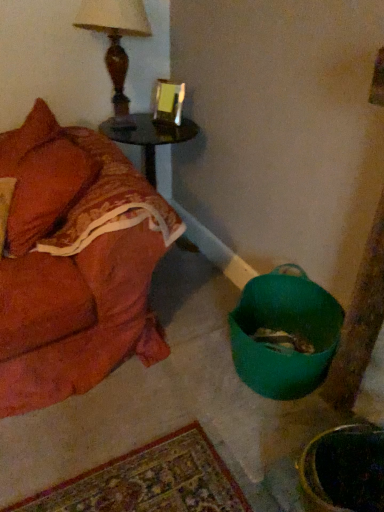
Question: Does shiny dark wood side table at upper left appear on the right side of wooden table lamp at upper left?

Choices:
 (A) no
 (B) yes

Answer: (B)

Question: Can wooden table lamp at upper left be found inside shiny dark wood side table at upper left?

Choices:
 (A) yes
 (B) no

Answer: (B)

Question: Is the position of shiny dark wood side table at upper left more distant than that of wooden table lamp at upper left?

Choices:
 (A) yes
 (B) no

Answer: (A)

Question: From a real-world perspective, is shiny dark wood side table at upper left positioned under wooden table lamp at upper left based on gravity?

Choices:
 (A) no
 (B) yes

Answer: (B)

Question: Does shiny dark wood side table at upper left come in front of wooden table lamp at upper left?

Choices:
 (A) no
 (B) yes

Answer: (A)

Question: Could you tell me if shiny dark wood side table at upper left is turned towards wooden table lamp at upper left?

Choices:
 (A) yes
 (B) no

Answer: (B)

Question: Are wooden table lamp at upper left and shiny dark wood side table at upper left beside each other?

Choices:
 (A) no
 (B) yes

Answer: (A)

Question: From the image's perspective, is wooden table lamp at upper left beneath shiny dark wood side table at upper left?

Choices:
 (A) no
 (B) yes

Answer: (A)

Question: Does wooden table lamp at upper left turn towards shiny dark wood side table at upper left?

Choices:
 (A) no
 (B) yes

Answer: (A)

Question: Can we say wooden table lamp at upper left lies outside shiny dark wood side table at upper left?

Choices:
 (A) yes
 (B) no

Answer: (A)

Question: From the image's perspective, would you say wooden table lamp at upper left is positioned over shiny dark wood side table at upper left?

Choices:
 (A) no
 (B) yes

Answer: (B)

Question: Can you confirm if wooden table lamp at upper left is thinner than shiny dark wood side table at upper left?

Choices:
 (A) yes
 (B) no

Answer: (A)

Question: Considering the relative positions of velvet orange couch at left and green plastic bucket at lower right in the image provided, is velvet orange couch at left to the left of green plastic bucket at lower right from the viewer's perspective?

Choices:
 (A) yes
 (B) no

Answer: (A)